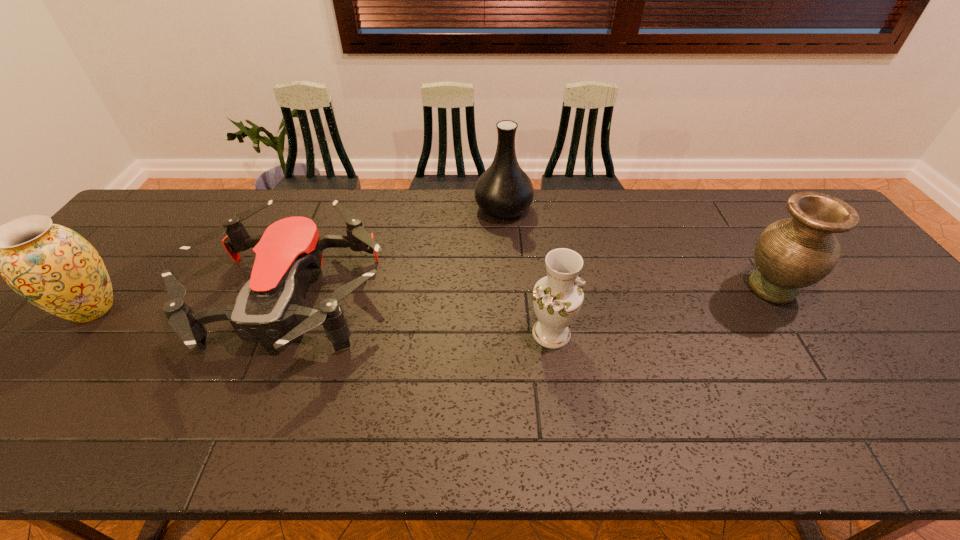
You are a GUI agent. You are given a task and a screenshot of the screen. Output one action in this format:
    pyautogui.click(x=<x>, y=<y>)
    Task: Click on the farthest vase
    The height and width of the screenshot is (540, 960).
    Given the screenshot: What is the action you would take?
    pyautogui.click(x=504, y=191)

Locate an element on the screen. This screenshot has width=960, height=540. the rightmost vase is located at coordinates pos(792,253).

Locate an element on the screen. the leftmost vase is located at coordinates (53, 267).

Locate an element on the screen. This screenshot has width=960, height=540. the shortest object is located at coordinates click(271, 303).

Identify the location of drone. (271, 303).

At what (x,y) coordinates should I click in order to perform the action: click on vacant space situated on the right of the farthest vase. Please return your answer as a coordinate pair (x, y). Looking at the image, I should click on (556, 209).

At what (x,y) coordinates should I click in order to perform the action: click on free space located on the back of the rightmost vase. Please return your answer as a coordinate pair (x, y). Looking at the image, I should click on (747, 249).

At what (x,y) coordinates should I click in order to perform the action: click on vacant space located 0.110m on the front of the leftmost object. Please return your answer as a coordinate pair (x, y). The image size is (960, 540). Looking at the image, I should click on (40, 374).

Locate an element on the screen. The image size is (960, 540). free spot located on the camera side of the shortest object is located at coordinates (239, 431).

Image resolution: width=960 pixels, height=540 pixels. I want to click on object situated at the far edge, so click(504, 191).